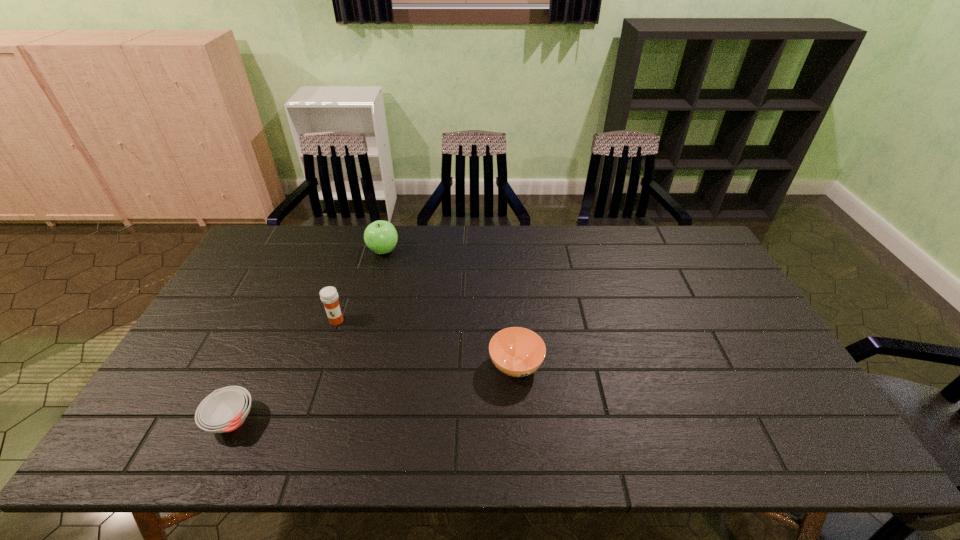
Where is `free spot between the apple and the right soup bowl`? This screenshot has width=960, height=540. free spot between the apple and the right soup bowl is located at coordinates (449, 308).

Where is `free space between the apple and the second farthest object`? The image size is (960, 540). free space between the apple and the second farthest object is located at coordinates (360, 286).

Identify the location of free space between the nearer soup bowl and the third farthest object. This screenshot has height=540, width=960. (373, 393).

Locate an element on the screen. The width and height of the screenshot is (960, 540). free space between the right soup bowl and the farthest object is located at coordinates (449, 308).

Where is `free point between the third object from right to left and the apple`? This screenshot has height=540, width=960. free point between the third object from right to left and the apple is located at coordinates (360, 286).

You are a GUI agent. You are given a task and a screenshot of the screen. Output one action in this format:
    pyautogui.click(x=<x>, y=<y>)
    Task: Click on the vacant space that is in between the right soup bowl and the shortest object
    
    Given the screenshot: What is the action you would take?
    pyautogui.click(x=373, y=393)

The width and height of the screenshot is (960, 540). I want to click on free space between the medicine and the apple, so click(x=360, y=286).

Where is `empty space that is in between the third nearest object and the apple`? The height and width of the screenshot is (540, 960). empty space that is in between the third nearest object and the apple is located at coordinates (360, 286).

Image resolution: width=960 pixels, height=540 pixels. I want to click on free space between the farther soup bowl and the third object from left to right, so click(x=449, y=308).

I want to click on the second closest object to the shorter soup bowl, so click(x=517, y=352).